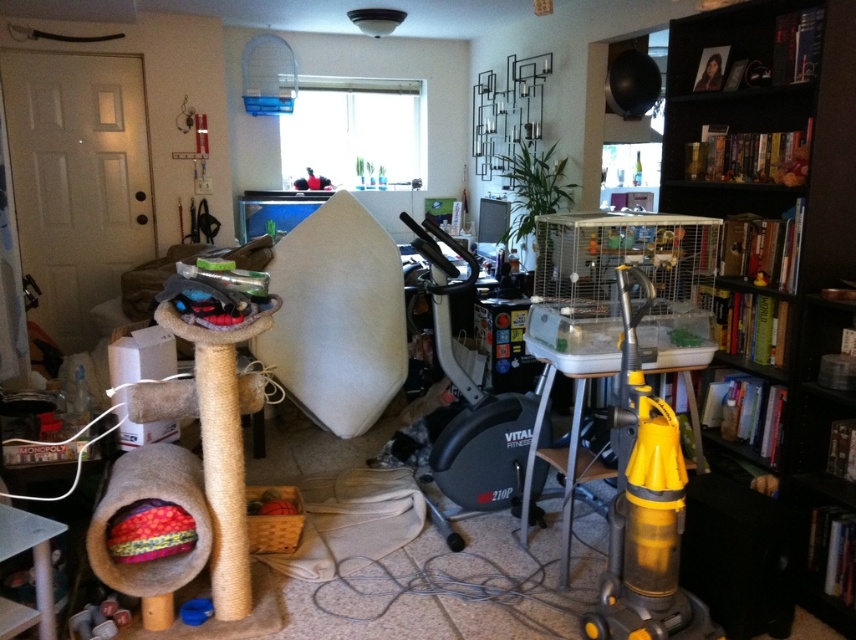
Question: Is black wood bookshelf at right below yellow plastic vacuum cleaner at right?

Choices:
 (A) yes
 (B) no

Answer: (B)

Question: Which object appears closest to the camera in this image?

Choices:
 (A) yellow plastic vacuum cleaner at right
 (B) black wood bookshelf at right

Answer: (A)

Question: Is black wood bookshelf at right to the left of yellow plastic vacuum cleaner at right from the viewer's perspective?

Choices:
 (A) no
 (B) yes

Answer: (A)

Question: In this image, where is black wood bookshelf at right located relative to yellow plastic vacuum cleaner at right?

Choices:
 (A) above
 (B) below

Answer: (A)